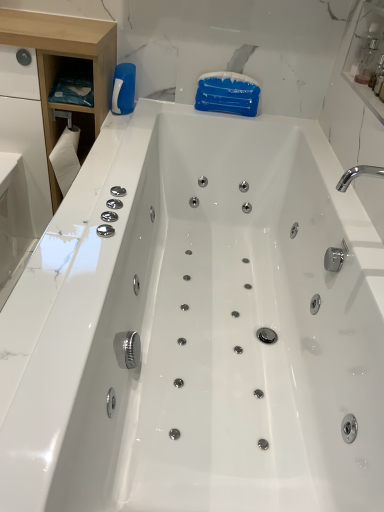
Question: From a real-world perspective, is white wood cabinet at left located higher than transparent plastic bottle at upper right?

Choices:
 (A) no
 (B) yes

Answer: (A)

Question: Does white wood cabinet at left have a lesser width compared to transparent plastic bottle at upper right?

Choices:
 (A) yes
 (B) no

Answer: (B)

Question: Is white wood cabinet at left in front of transparent plastic bottle at upper right?

Choices:
 (A) no
 (B) yes

Answer: (B)

Question: From a real-world perspective, is white wood cabinet at left below transparent plastic bottle at upper right?

Choices:
 (A) yes
 (B) no

Answer: (A)

Question: Is white wood cabinet at left touching transparent plastic bottle at upper right?

Choices:
 (A) no
 (B) yes

Answer: (A)

Question: Considering the relative sizes of white wood cabinet at left and transparent plastic bottle at upper right in the image provided, is white wood cabinet at left shorter than transparent plastic bottle at upper right?

Choices:
 (A) yes
 (B) no

Answer: (B)

Question: Could you tell me if white paper towel at left is turned towards white wood cabinet at left?

Choices:
 (A) no
 (B) yes

Answer: (B)

Question: Does white paper towel at left have a lesser width compared to white wood cabinet at left?

Choices:
 (A) yes
 (B) no

Answer: (A)

Question: Is white paper towel at left further to camera compared to white wood cabinet at left?

Choices:
 (A) yes
 (B) no

Answer: (A)

Question: Does white paper towel at left have a greater height compared to white wood cabinet at left?

Choices:
 (A) yes
 (B) no

Answer: (B)

Question: Considering the relative positions of white paper towel at left and white wood cabinet at left in the image provided, is white paper towel at left to the right of white wood cabinet at left from the viewer's perspective?

Choices:
 (A) no
 (B) yes

Answer: (B)

Question: Does white paper towel at left contain white wood cabinet at left?

Choices:
 (A) yes
 (B) no

Answer: (B)

Question: Considering the relative sizes of transparent plastic bottle at upper right and white paper towel at left in the image provided, is transparent plastic bottle at upper right taller than white paper towel at left?

Choices:
 (A) no
 (B) yes

Answer: (A)